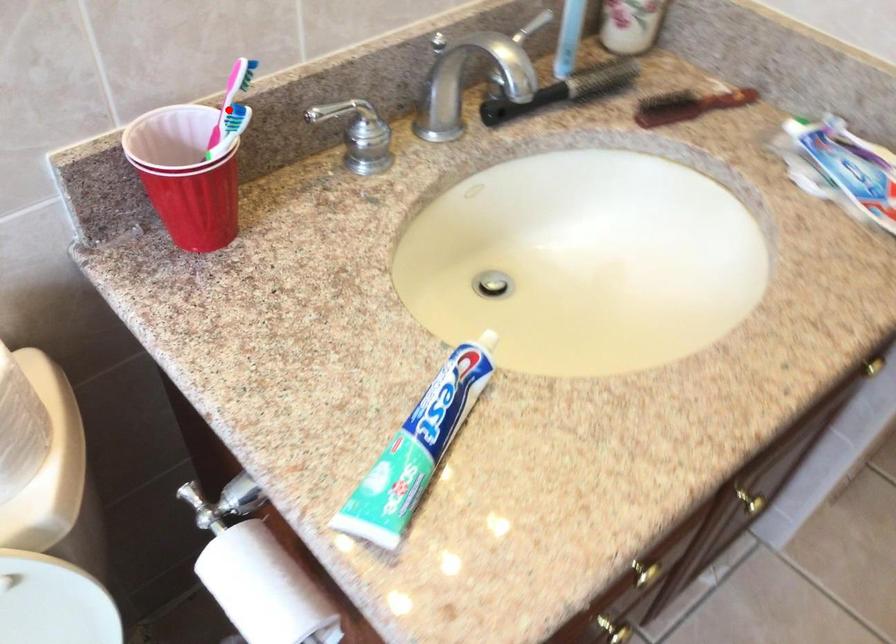
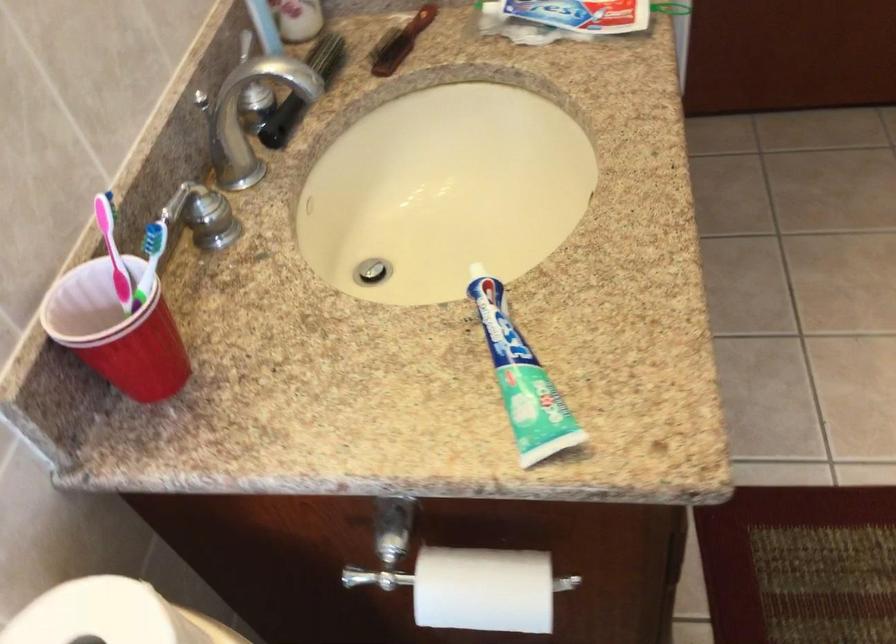
The point at the highlighted location is marked in the first image. Where is the corresponding point in the second image?

(113, 251)